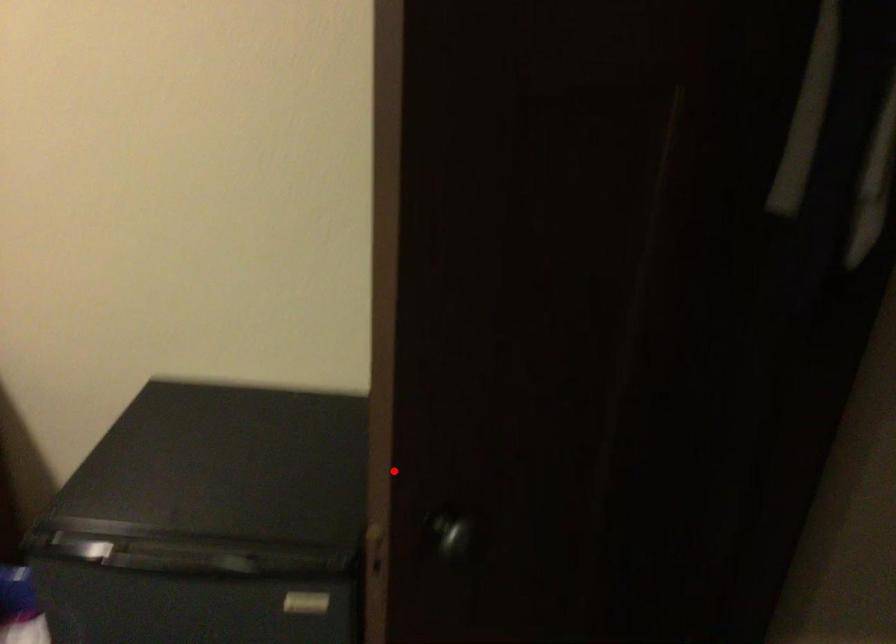
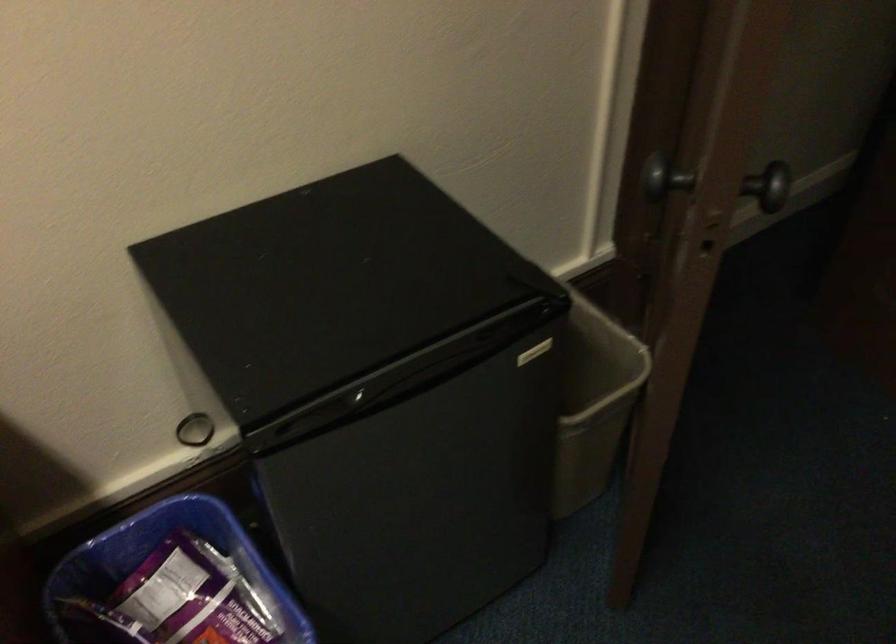
Where in the second image is the point corresponding to the highlighted location from the first image?

(656, 174)